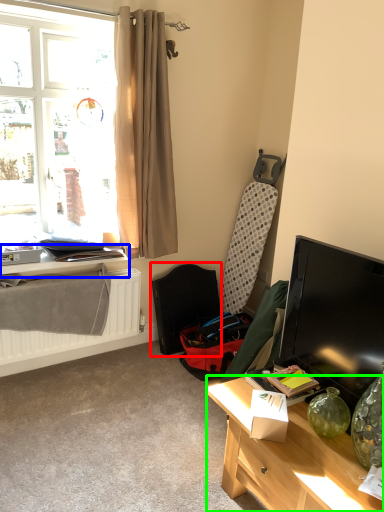
Question: Estimate the real-world distances between objects in this image. Which object is farther from folding chair (highlighted by a red box), table (highlighted by a blue box) or desk (highlighted by a green box)?

Choices:
 (A) table
 (B) desk

Answer: (B)